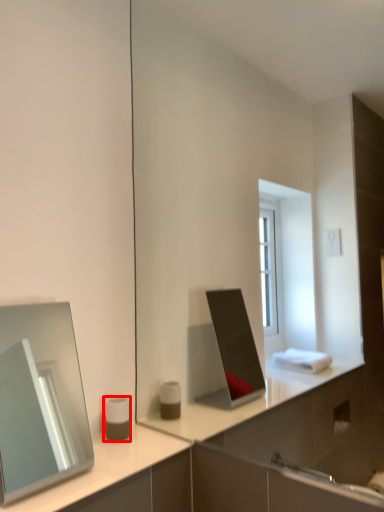
Question: Considering the relative positions of toiletry (annotated by the red box) and mirror in the image provided, where is toiletry (annotated by the red box) located with respect to the staircase?

Choices:
 (A) left
 (B) right

Answer: (B)